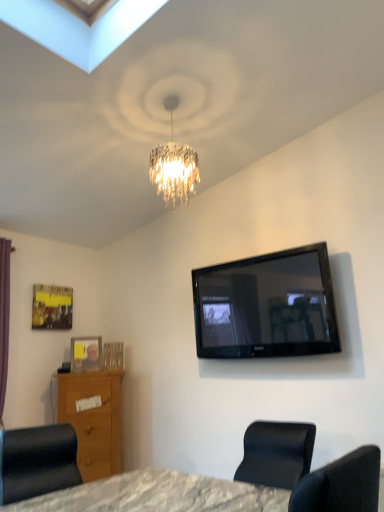
Question: Is point (54, 294) closer or farther from the camera than point (13, 429)?

Choices:
 (A) closer
 (B) farther

Answer: (B)

Question: Considering their positions, is metallic gold picture frame at upper left, acting as the 2th picture frame starting from the right, located in front of or behind matte black chair at lower left?

Choices:
 (A) behind
 (B) front

Answer: (A)

Question: Based on their relative distances, which object is farther from the wooden vanity at lower left?

Choices:
 (A) clear plastic picture frame at lower left, acting as the first picture frame starting from the right
 (B) metallic gold picture frame at upper left, which appears as the first picture frame when viewed from the top
 (C) black glossy tv at upper right
 (D) matte black chair at lower left

Answer: (C)

Question: Estimate the real-world distances between objects in this image. Which object is closer to the matte black chair at lower left?

Choices:
 (A) wooden vanity at lower left
 (B) black glossy tv at upper right
 (C) clear plastic picture frame at lower left, acting as the first picture frame starting from the right
 (D) metallic gold picture frame at upper left, which appears as the first picture frame when viewed from the top

Answer: (A)